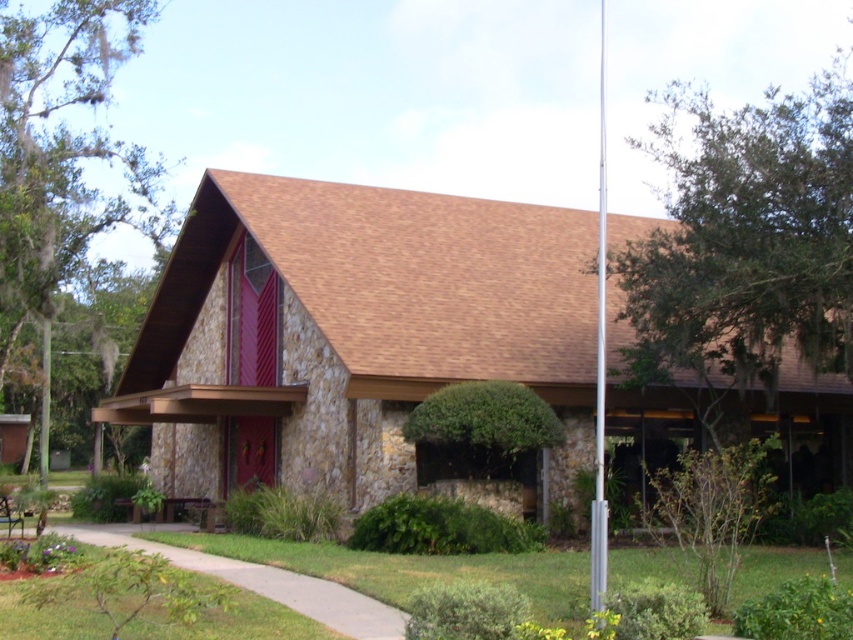
Is point (117, 52) closer to camera compared to point (605, 241)?

No.

Can you confirm if green mossy tree at lower left is bigger than silver metallic flag pole at center?

Yes.

Which is behind, point (132, 16) or point (598, 275)?

The point (132, 16) is behind.

I want to click on green mossy tree at lower left, so click(62, 161).

Between point (694, 108) and point (137, 193), which one is positioned in front?

Positioned in front is point (137, 193).

Can you confirm if green leafy tree at upper right is smaller than green mossy tree at lower left?

Yes.

At what (x,y) coordinates should I click in order to perform the action: click on green leafy tree at upper right. Please return your answer as a coordinate pair (x, y). Image resolution: width=853 pixels, height=640 pixels. Looking at the image, I should click on (746, 243).

Identify the location of green leafy tree at upper right. The height and width of the screenshot is (640, 853). (746, 243).

Is brown stone church at center behind green leafy tree at upper right?

Yes, it is behind green leafy tree at upper right.

Can you confirm if brown stone church at center is thinner than green leafy tree at upper right?

Indeed, brown stone church at center has a lesser width compared to green leafy tree at upper right.

The height and width of the screenshot is (640, 853). In order to click on brown stone church at center in this screenshot , I will do `click(351, 332)`.

The height and width of the screenshot is (640, 853). In order to click on brown stone church at center in this screenshot , I will do [x=351, y=332].